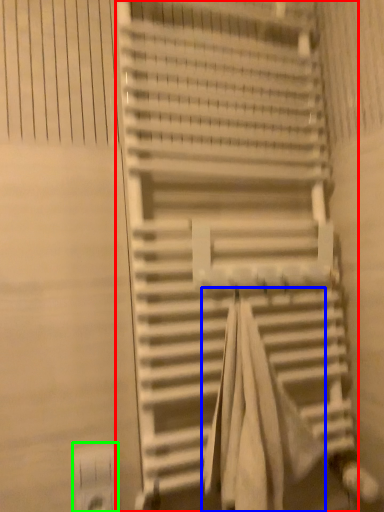
Question: Based on their relative distances, which object is nearer to stairs (highlighted by a red box)? Choose from beach towel (highlighted by a blue box) and electric outlet (highlighted by a green box).

Choices:
 (A) beach towel
 (B) electric outlet

Answer: (A)